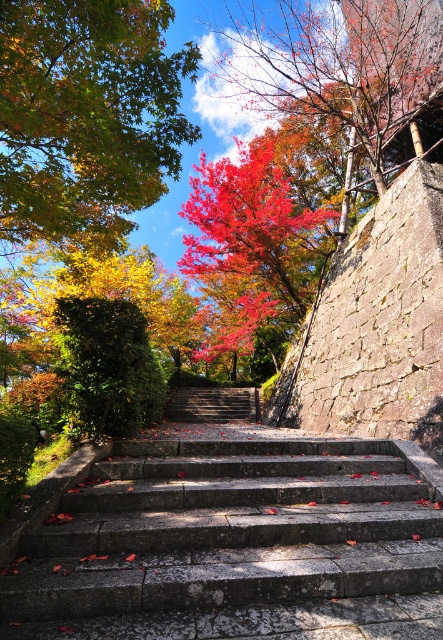
Question: Can you confirm if gray stone stairs at center is bigger than dark brown stone stairs at center?

Choices:
 (A) yes
 (B) no

Answer: (A)

Question: Does shiny red maple leaves at upper center have a greater width compared to vivid red leaves at center?

Choices:
 (A) no
 (B) yes

Answer: (A)

Question: Is shiny red leaves at upper center to the right of dark brown stone stairs at center from the viewer's perspective?

Choices:
 (A) no
 (B) yes

Answer: (B)

Question: Which of the following is the farthest from the observer?

Choices:
 (A) (295, 276)
 (B) (57, 529)
 (C) (300, 8)

Answer: (A)

Question: Among these points, which one is nearest to the camera?

Choices:
 (A) (53, 634)
 (B) (80, 200)
 (C) (325, 227)

Answer: (A)

Question: Among these points, which one is farthest from the camera?

Choices:
 (A) (396, 65)
 (B) (160, 49)

Answer: (A)